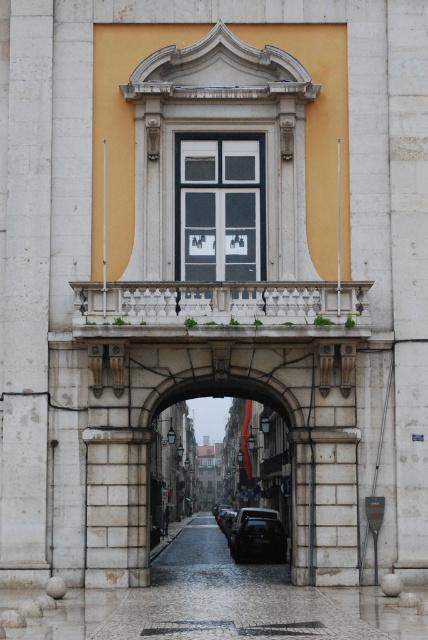
Question: Does matte glass window at center appear over stone archway at center?

Choices:
 (A) yes
 (B) no

Answer: (A)

Question: Does matte glass window at center have a greater width compared to stone archway at center?

Choices:
 (A) yes
 (B) no

Answer: (B)

Question: Considering the real-world distances, which object is farthest from the shiny black car at center?

Choices:
 (A) matte glass window at center
 (B) stone archway at center

Answer: (A)

Question: Based on their relative distances, which object is farther from the shiny black car at center?

Choices:
 (A) matte glass window at center
 (B) stone archway at center

Answer: (A)

Question: Does matte glass window at center appear on the right side of shiny black car at center?

Choices:
 (A) yes
 (B) no

Answer: (B)

Question: Which of these objects is positioned closest to the shiny black car at center?

Choices:
 (A) stone archway at center
 (B) matte glass window at center

Answer: (A)